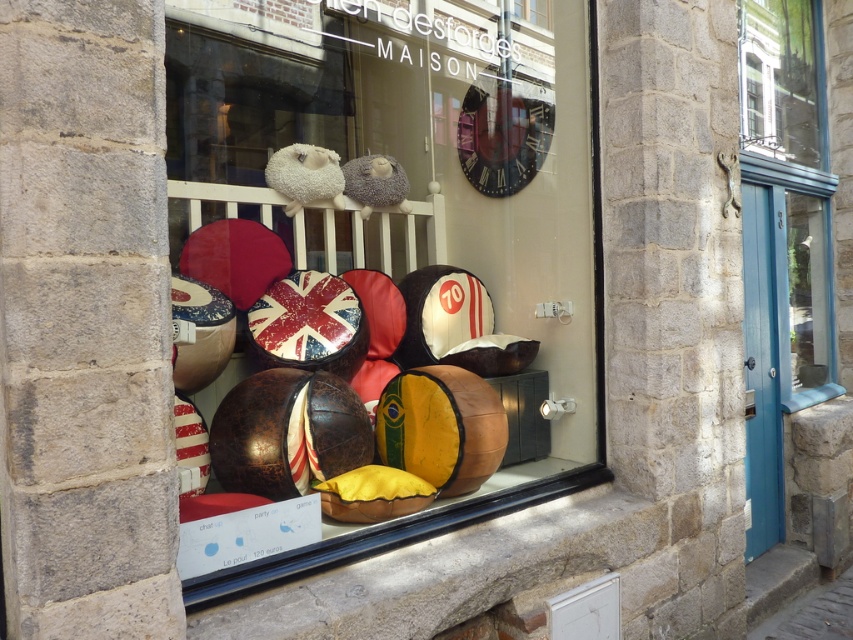
Question: Among these objects, which one is nearest to the camera?

Choices:
 (A) black leather window sill at lower center
 (B) blue glass door at right
 (C) leather pillows at center
 (D) clear glass window at upper right

Answer: (A)

Question: Estimate the real-world distances between objects in this image. Which object is closer to the clear glass window at upper right?

Choices:
 (A) blue glass door at right
 (B) leather pillows at center
 (C) black leather window sill at lower center

Answer: (A)

Question: Which of the following is the closest to the observer?

Choices:
 (A) (793, 17)
 (B) (221, 285)
 (C) (524, 484)

Answer: (C)

Question: Is clear glass window at upper right to the left of black leather window sill at lower center from the viewer's perspective?

Choices:
 (A) yes
 (B) no

Answer: (B)

Question: Where is leather pillows at center located in relation to blue glass door at right in the image?

Choices:
 (A) right
 (B) left

Answer: (B)

Question: Can you confirm if leather pillows at center is bigger than clear glass window at upper right?

Choices:
 (A) yes
 (B) no

Answer: (A)